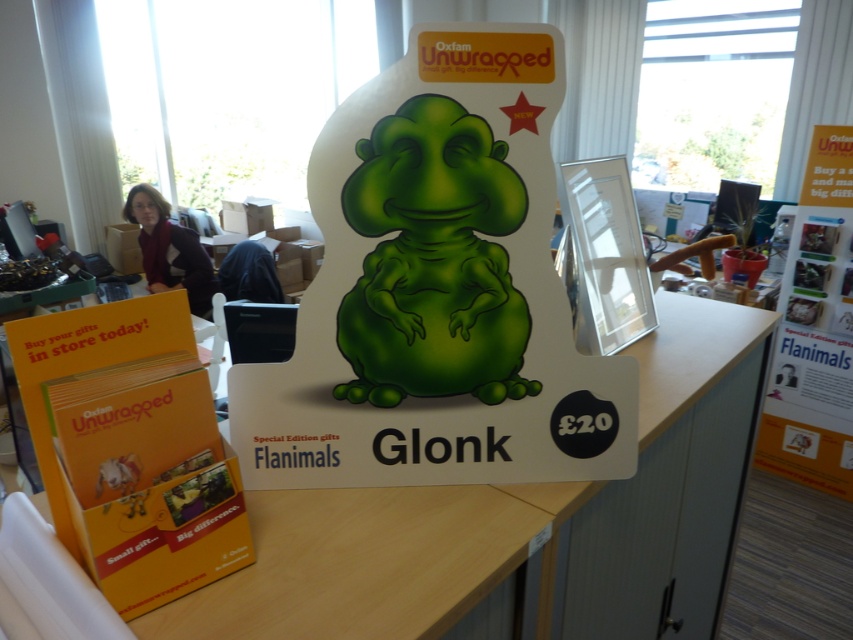
In the scene shown: Who is lower down, white matte table at center or white paper poster at upper right?

white matte table at center is below.

Which of these two, white matte table at center or white paper poster at upper right, stands shorter?

Standing shorter between the two is white matte table at center.

Find the location of a particular element. This screenshot has width=853, height=640. white matte table at center is located at coordinates point(520,522).

The image size is (853, 640). In order to click on white matte table at center in this screenshot , I will do `click(520, 522)`.